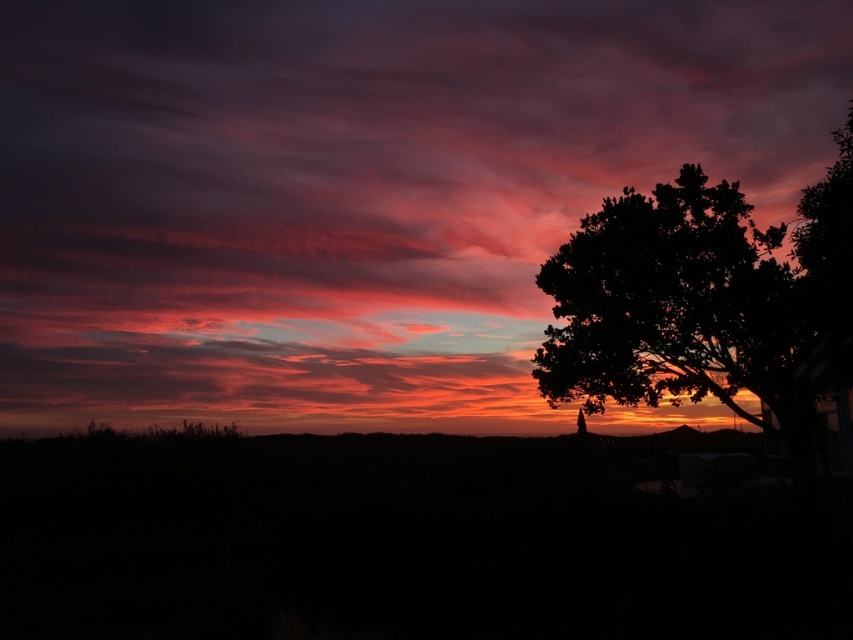
Question: Is matte pink cloud at upper center further to camera compared to silhouette tree at right?

Choices:
 (A) no
 (B) yes

Answer: (B)

Question: Can you confirm if matte pink cloud at upper center is bigger than silhouette tree at right?

Choices:
 (A) yes
 (B) no

Answer: (A)

Question: Is matte pink cloud at upper center smaller than silhouette tree at right?

Choices:
 (A) yes
 (B) no

Answer: (B)

Question: Which object is closer to the camera taking this photo?

Choices:
 (A) silhouette tree at right
 (B) matte pink cloud at upper center

Answer: (A)

Question: Which of the following is the closest to the observer?

Choices:
 (A) pyautogui.click(x=514, y=228)
 (B) pyautogui.click(x=695, y=259)

Answer: (B)